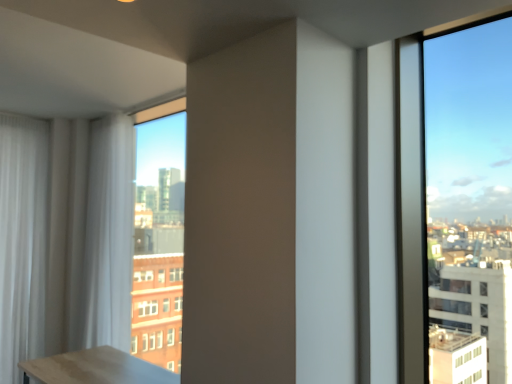
What do you see at coordinates (109, 234) in the screenshot?
I see `white sheer curtain at left, which is the second curtain from left to right` at bounding box center [109, 234].

What is the approximate width of white sheer curtain at left, which is counted as the first curtain, starting from the right?

white sheer curtain at left, which is counted as the first curtain, starting from the right, is 10.53 inches wide.

The height and width of the screenshot is (384, 512). In order to click on white sheer curtain at left, which is counted as the first curtain, starting from the right in this screenshot , I will do `click(109, 234)`.

At what (x,y) coordinates should I click in order to perform the action: click on white sheer curtain at left, marked as the 1th curtain in a left-to-right arrangement. Please return your answer as a coordinate pair (x, y). Looking at the image, I should click on (22, 241).

The width and height of the screenshot is (512, 384). What do you see at coordinates (22, 241) in the screenshot? I see `white sheer curtain at left, acting as the 2th curtain starting from the right` at bounding box center [22, 241].

You are a GUI agent. You are given a task and a screenshot of the screen. Output one action in this format:
    pyautogui.click(x=<x>, y=<y>)
    Task: Click on the white sheer curtain at left, which is counted as the first curtain, starting from the right
    This screenshot has width=512, height=384.
    Given the screenshot: What is the action you would take?
    pos(109,234)

Is white sheer curtain at left, which is the second curtain from left to right, to the right of white sheer curtain at left, acting as the 2th curtain starting from the right, from the viewer's perspective?

Yes.

Considering the positions of objects white sheer curtain at left, which is counted as the first curtain, starting from the right, and white sheer curtain at left, marked as the 1th curtain in a left-to-right arrangement, in the image provided, who is in front, white sheer curtain at left, which is counted as the first curtain, starting from the right, or white sheer curtain at left, marked as the 1th curtain in a left-to-right arrangement,?

Positioned in front is white sheer curtain at left, which is counted as the first curtain, starting from the right.

Which is farther from the camera, (101, 215) or (15, 117)?

The point (15, 117) is farther from the camera.

From the image's perspective, who appears lower, white sheer curtain at left, which is the second curtain from left to right, or white sheer curtain at left, acting as the 2th curtain starting from the right?

white sheer curtain at left, acting as the 2th curtain starting from the right, is shown below in the image.

From a real-world perspective, who is located lower, white sheer curtain at left, which is counted as the first curtain, starting from the right, or white sheer curtain at left, acting as the 2th curtain starting from the right?

white sheer curtain at left, acting as the 2th curtain starting from the right.

Is white sheer curtain at left, which is the second curtain from left to right, wider or thinner than white sheer curtain at left, marked as the 1th curtain in a left-to-right arrangement?

Clearly, white sheer curtain at left, which is the second curtain from left to right, has more width compared to white sheer curtain at left, marked as the 1th curtain in a left-to-right arrangement.

Is white sheer curtain at left, which is counted as the first curtain, starting from the right, taller or shorter than white sheer curtain at left, acting as the 2th curtain starting from the right?

In the image, white sheer curtain at left, which is counted as the first curtain, starting from the right, appears to be shorter than white sheer curtain at left, acting as the 2th curtain starting from the right.

Does white sheer curtain at left, which is the second curtain from left to right, have a smaller size compared to white sheer curtain at left, marked as the 1th curtain in a left-to-right arrangement?

No.

Consider the image. Is white sheer curtain at left, which is counted as the first curtain, starting from the right, inside or outside of white sheer curtain at left, acting as the 2th curtain starting from the right?

white sheer curtain at left, which is counted as the first curtain, starting from the right, is not enclosed by white sheer curtain at left, acting as the 2th curtain starting from the right.

Is there a large distance between white sheer curtain at left, which is counted as the first curtain, starting from the right, and white sheer curtain at left, marked as the 1th curtain in a left-to-right arrangement?

No, there isn't a large distance between white sheer curtain at left, which is counted as the first curtain, starting from the right, and white sheer curtain at left, marked as the 1th curtain in a left-to-right arrangement.

Is white sheer curtain at left, which is counted as the first curtain, starting from the right, positioned with its back to white sheer curtain at left, acting as the 2th curtain starting from the right?

white sheer curtain at left, which is counted as the first curtain, starting from the right, is not turned away from white sheer curtain at left, acting as the 2th curtain starting from the right.

What's the angular difference between white sheer curtain at left, which is the second curtain from left to right, and white sheer curtain at left, acting as the 2th curtain starting from the right,'s facing directions?

84.7 degrees.

The width and height of the screenshot is (512, 384). In order to click on curtain located in front of the white sheer curtain at left, marked as the 1th curtain in a left-to-right arrangement in this screenshot , I will do `click(109, 234)`.

In the image, is white sheer curtain at left, marked as the 1th curtain in a left-to-right arrangement, on the left side or the right side of white sheer curtain at left, which is counted as the first curtain, starting from the right?

From the image, it's evident that white sheer curtain at left, marked as the 1th curtain in a left-to-right arrangement, is to the left of white sheer curtain at left, which is counted as the first curtain, starting from the right.

Considering the relative positions of white sheer curtain at left, acting as the 2th curtain starting from the right, and white sheer curtain at left, which is counted as the first curtain, starting from the right, in the image provided, is white sheer curtain at left, acting as the 2th curtain starting from the right, in front of white sheer curtain at left, which is counted as the first curtain, starting from the right,?

No, it is behind white sheer curtain at left, which is counted as the first curtain, starting from the right.

Does point (8, 274) lie in front of point (86, 244)?

No.

Based on the photo, from the image's perspective, is white sheer curtain at left, acting as the 2th curtain starting from the right, above white sheer curtain at left, which is the second curtain from left to right?

Incorrect, from the image's perspective, white sheer curtain at left, acting as the 2th curtain starting from the right, is lower than white sheer curtain at left, which is the second curtain from left to right.

From a real-world perspective, who is located lower, white sheer curtain at left, marked as the 1th curtain in a left-to-right arrangement, or white sheer curtain at left, which is counted as the first curtain, starting from the right?

From a 3D spatial view, white sheer curtain at left, marked as the 1th curtain in a left-to-right arrangement, is below.

Which of these two, white sheer curtain at left, acting as the 2th curtain starting from the right, or white sheer curtain at left, which is counted as the first curtain, starting from the right, is wider?

Wider between the two is white sheer curtain at left, which is counted as the first curtain, starting from the right.

Considering the relative sizes of white sheer curtain at left, acting as the 2th curtain starting from the right, and white sheer curtain at left, which is the second curtain from left to right, in the image provided, is white sheer curtain at left, acting as the 2th curtain starting from the right, taller than white sheer curtain at left, which is the second curtain from left to right,?

Yes, white sheer curtain at left, acting as the 2th curtain starting from the right, is taller than white sheer curtain at left, which is the second curtain from left to right.

Can you confirm if white sheer curtain at left, acting as the 2th curtain starting from the right, is smaller than white sheer curtain at left, which is counted as the first curtain, starting from the right?

Yes, white sheer curtain at left, acting as the 2th curtain starting from the right, is smaller than white sheer curtain at left, which is counted as the first curtain, starting from the right.

Would you say white sheer curtain at left, acting as the 2th curtain starting from the right, is inside or outside white sheer curtain at left, which is the second curtain from left to right?

white sheer curtain at left, acting as the 2th curtain starting from the right, is spatially situated outside white sheer curtain at left, which is the second curtain from left to right.

Would you consider white sheer curtain at left, marked as the 1th curtain in a left-to-right arrangement, to be distant from white sheer curtain at left, which is the second curtain from left to right?

No, white sheer curtain at left, marked as the 1th curtain in a left-to-right arrangement, is not far from white sheer curtain at left, which is the second curtain from left to right.

Could you tell me if white sheer curtain at left, marked as the 1th curtain in a left-to-right arrangement, is turned towards white sheer curtain at left, which is counted as the first curtain, starting from the right?

No, white sheer curtain at left, marked as the 1th curtain in a left-to-right arrangement, is not aimed at white sheer curtain at left, which is counted as the first curtain, starting from the right.

Can you tell me how much white sheer curtain at left, acting as the 2th curtain starting from the right, and white sheer curtain at left, which is the second curtain from left to right, differ in facing direction?

The facing directions of white sheer curtain at left, acting as the 2th curtain starting from the right, and white sheer curtain at left, which is the second curtain from left to right, are 84.7 degrees apart.

Where is `curtain on the right of white sheer curtain at left, acting as the 2th curtain starting from the right`? curtain on the right of white sheer curtain at left, acting as the 2th curtain starting from the right is located at coordinates click(109, 234).

At what (x,y) coordinates should I click in order to perform the action: click on curtain in front of the white sheer curtain at left, marked as the 1th curtain in a left-to-right arrangement. Please return your answer as a coordinate pair (x, y). This screenshot has width=512, height=384. Looking at the image, I should click on (109, 234).

This screenshot has height=384, width=512. In order to click on curtain lying on the left of white sheer curtain at left, which is the second curtain from left to right in this screenshot , I will do `click(22, 241)`.